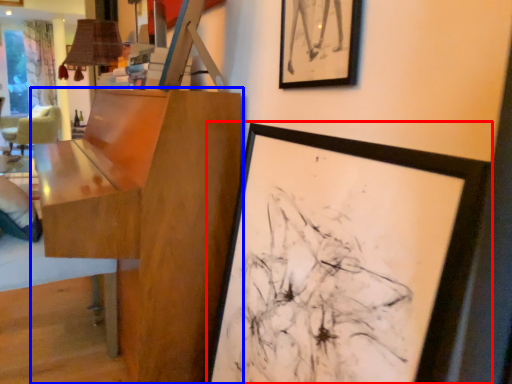
Question: Which point is closer to the camera, picture frame (highlighted by a red box) or table (highlighted by a blue box)?

Choices:
 (A) picture frame
 (B) table

Answer: (A)